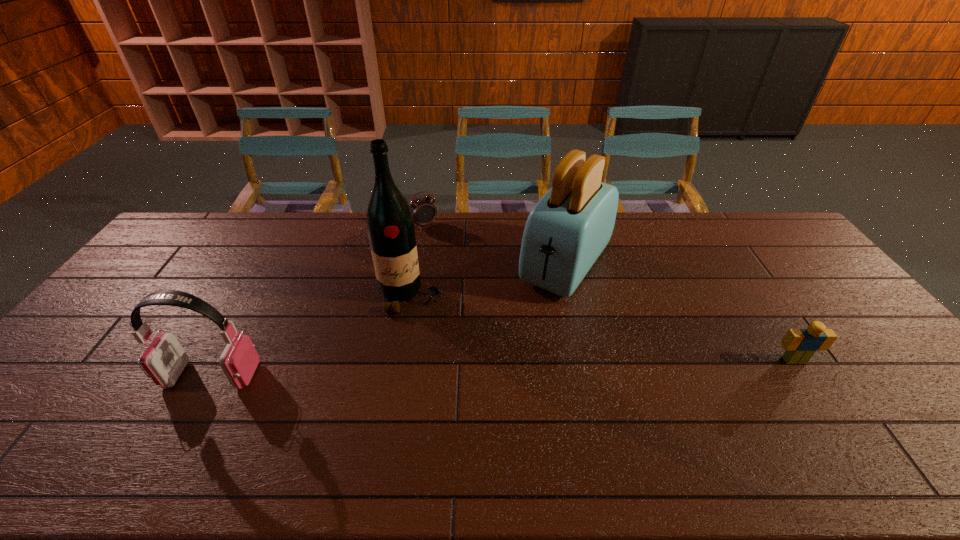
I want to click on free space between the wine bottle and the earphone, so click(x=311, y=335).

What are the coordinates of `free area in between the alarm clock and the third shortest object` in the screenshot? It's located at (318, 300).

This screenshot has width=960, height=540. Identify the location of empty location between the alarm clock and the rightmost object. (609, 292).

Find the location of `free spot between the wine bottle and the toaster`. free spot between the wine bottle and the toaster is located at coordinates (488, 280).

In order to click on vacant area that lies between the rightmost object and the second object from right to left in this screenshot , I will do `click(680, 313)`.

The image size is (960, 540). I want to click on the fourth closest object relative to the alarm clock, so click(800, 344).

At what (x,y) coordinates should I click in order to perform the action: click on object that is the second closest one to the rightmost object. Please return your answer as a coordinate pair (x, y). Looking at the image, I should click on (390, 225).